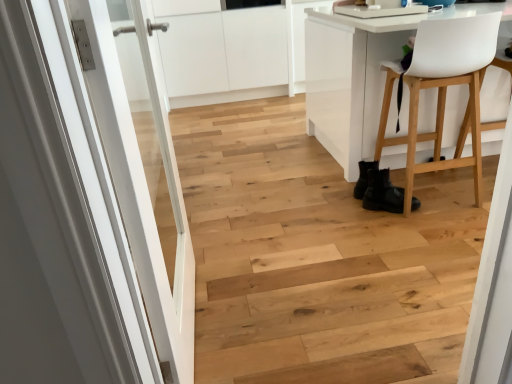
Question: Considering their positions, is white plastic chair at right located in front of or behind black leather boots at lower right?

Choices:
 (A) behind
 (B) front

Answer: (B)

Question: Visually, is white plastic chair at right positioned to the left or to the right of black leather boots at lower right?

Choices:
 (A) right
 (B) left

Answer: (A)

Question: Considering the real-world distances, which object is closest to the black leather boots at lower right?

Choices:
 (A) white plastic chair at right
 (B) white glossy door at left

Answer: (A)

Question: Based on their relative distances, which object is farther from the white glossy door at left?

Choices:
 (A) white plastic chair at right
 (B) black leather boots at lower right

Answer: (A)